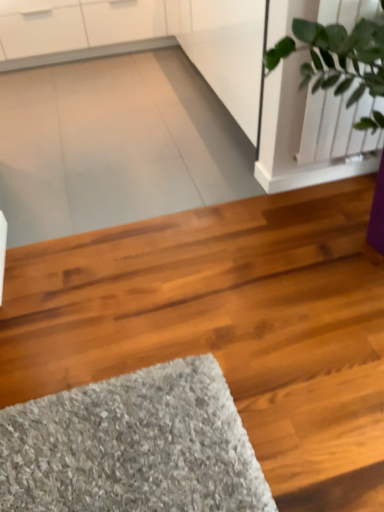
Question: Looking at their shapes, would you say shiny brown hardwood at center is wider or thinner than green leafy plant at upper right?

Choices:
 (A) thin
 (B) wide

Answer: (B)

Question: Based on their positions, is shiny brown hardwood at center located to the left or right of green leafy plant at upper right?

Choices:
 (A) left
 (B) right

Answer: (A)

Question: Is point (296, 200) positioned closer to the camera than point (319, 26)?

Choices:
 (A) farther
 (B) closer

Answer: (A)

Question: Is green leafy plant at upper right taller or shorter than shiny brown hardwood at center?

Choices:
 (A) short
 (B) tall

Answer: (B)

Question: Would you say green leafy plant at upper right is inside or outside shiny brown hardwood at center?

Choices:
 (A) outside
 (B) inside

Answer: (A)

Question: Based on their sizes in the image, would you say green leafy plant at upper right is bigger or smaller than shiny brown hardwood at center?

Choices:
 (A) small
 (B) big

Answer: (A)

Question: From the image's perspective, is green leafy plant at upper right above or below shiny brown hardwood at center?

Choices:
 (A) below
 (B) above

Answer: (B)